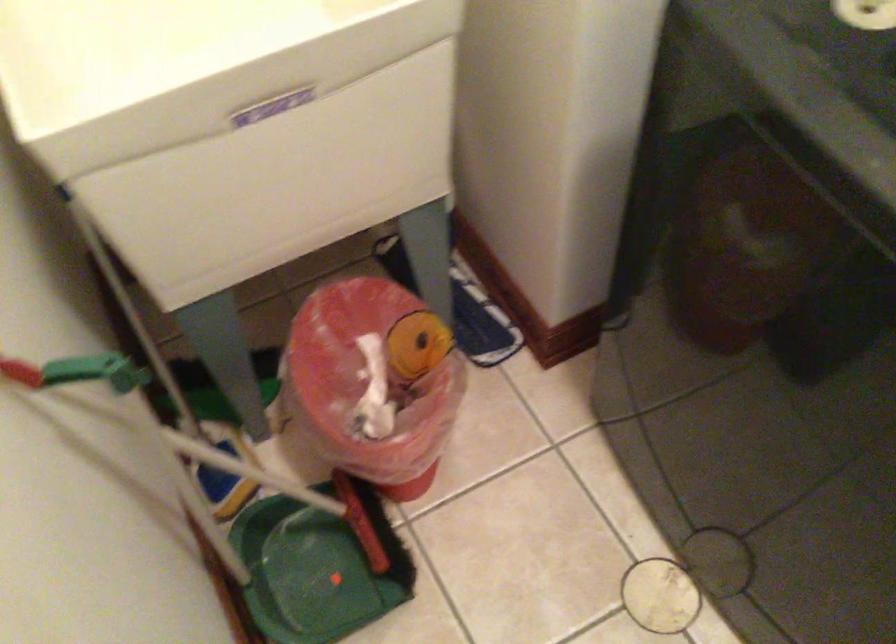
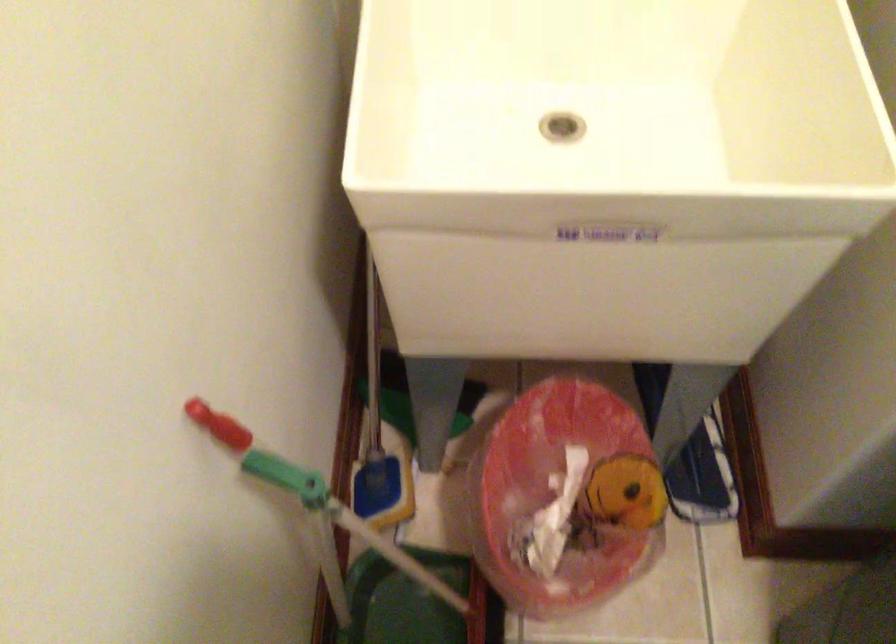
In the second image, find the point that corresponds to [367,383] in the first image.

(555, 496)